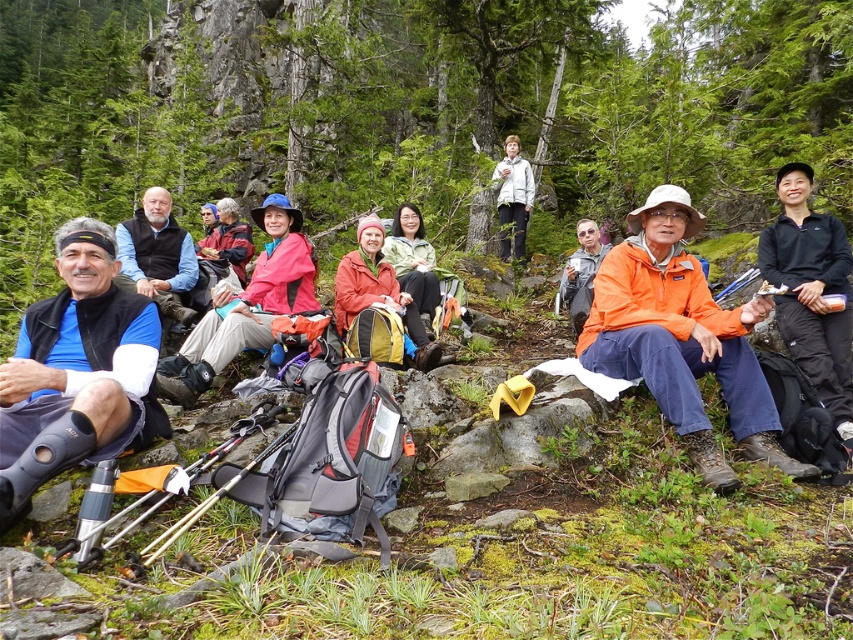
Is matte orange jacket at center smaller than light gray jacket at center?

Yes, matte orange jacket at center is smaller than light gray jacket at center.

What do you see at coordinates (378, 291) in the screenshot? I see `matte orange jacket at center` at bounding box center [378, 291].

Locate an element on the screen. The height and width of the screenshot is (640, 853). matte orange jacket at center is located at coordinates (378, 291).

Is point (192, 333) positioned in front of point (437, 362)?

Yes, point (192, 333) is closer to viewer.

Does matte pink jacket at center have a lesser width compared to matte orange jacket at center?

In fact, matte pink jacket at center might be wider than matte orange jacket at center.

Find the location of a particular element. This screenshot has height=640, width=853. matte pink jacket at center is located at coordinates (247, 307).

Where is `matte pink jacket at center`? This screenshot has height=640, width=853. matte pink jacket at center is located at coordinates (247, 307).

Is matte pink jacket at center above light gray jacket at center?

Actually, matte pink jacket at center is below light gray jacket at center.

Is matte pink jacket at center behind light gray jacket at center?

No, it is not.

What do you see at coordinates (247, 307) in the screenshot?
I see `matte pink jacket at center` at bounding box center [247, 307].

In order to click on matte pink jacket at center in this screenshot , I will do `click(247, 307)`.